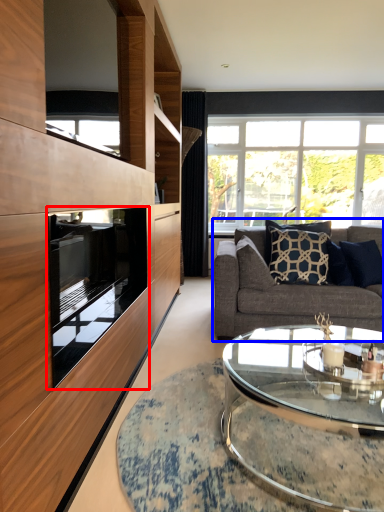
Question: Among these objects, which one is nearest to the camera, oven (highlighted by a red box) or studio couch (highlighted by a blue box)?

Choices:
 (A) oven
 (B) studio couch

Answer: (A)